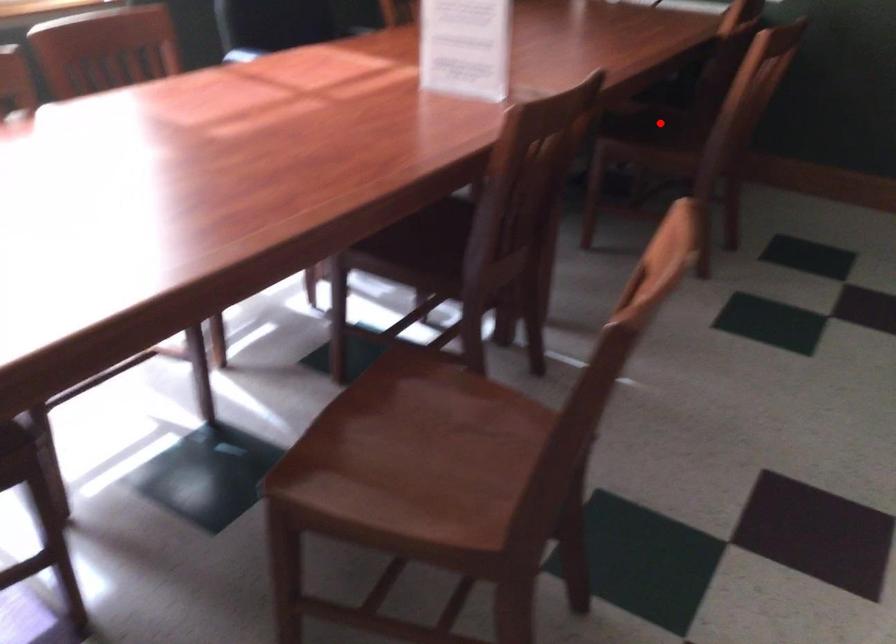
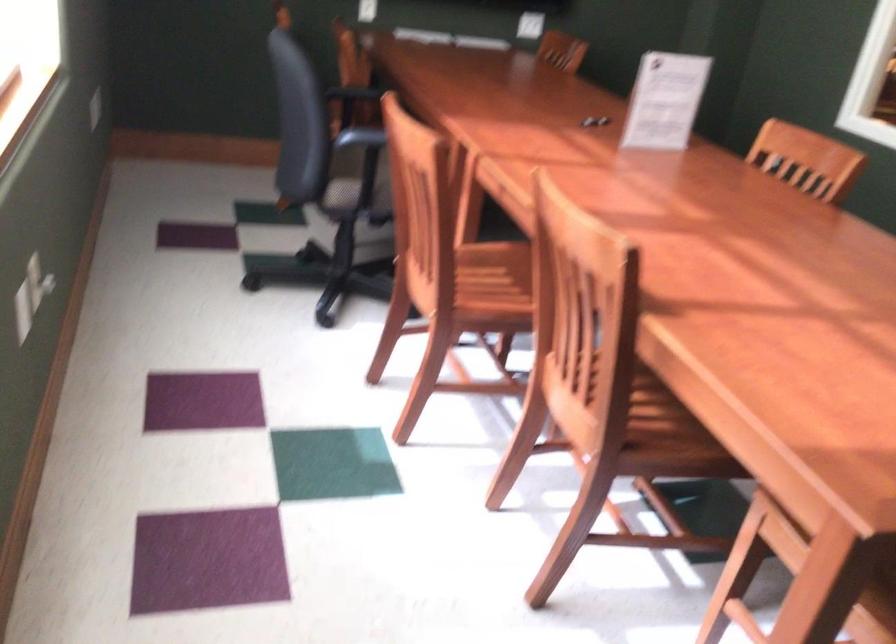
Question: I am providing you with two images of the same scene from different viewpoints. A red point is marked on the first image. Is the red point's position out of view in image 2?

Choices:
 (A) Yes
 (B) No

Answer: (A)